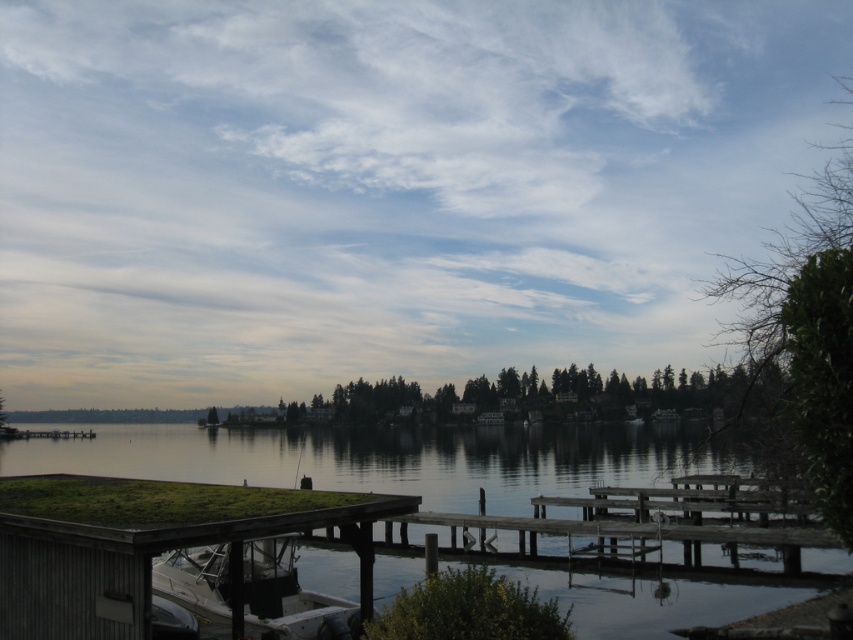
You are standing on the wooden dock and want to check the width of the clear water at lower center and the white matte boat at lower left. Which one do you think is wider?

The clear water at lower center might be wider than white matte boat at lower left according to the description.

You are standing at point (842, 554) and want to walk to the boat. The path is 20.90 meters long. If you walk at 1.5 meters per second, how long will it take you to reach the boat?

The distance between point (842, 554) and the boat is 20.90 meters. At a walking speed of 1.5 meters per second, it will take approximately 14 seconds to reach the boat.

You are standing on the wooden dock and want to see the clear water at lower center. However, the white matte boat at lower left is blocking your view. Can you move the boat to get a better view of the water?

The clear water at lower center is positioned under the white matte boat at lower left, so moving the boat would allow you to see the clear water at lower center more clearly.